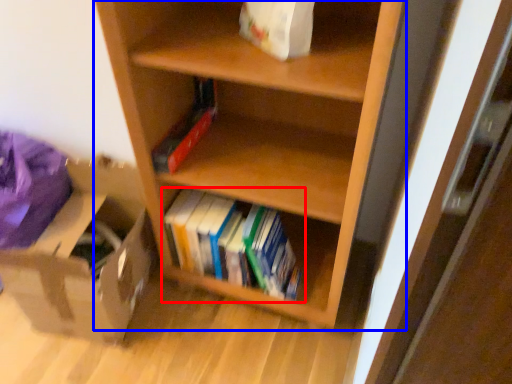
Question: Which object is closer to the camera taking this photo, book (highlighted by a red box) or shelf (highlighted by a blue box)?

Choices:
 (A) book
 (B) shelf

Answer: (B)